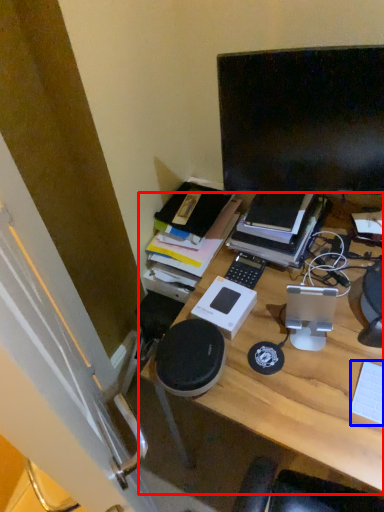
Question: Which object appears farthest to the camera in this image, desk (highlighted by a red box) or computer keyboard (highlighted by a blue box)?

Choices:
 (A) desk
 (B) computer keyboard

Answer: (B)